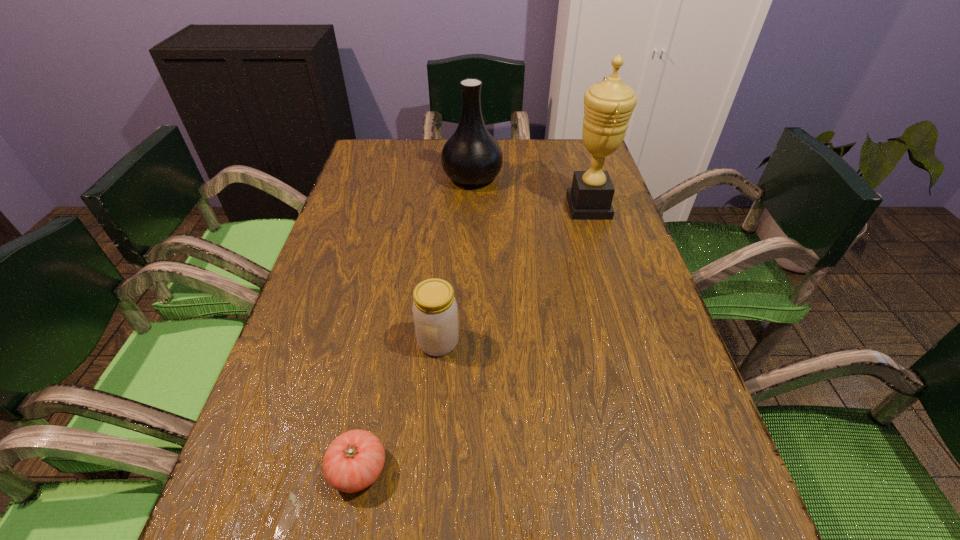
The image size is (960, 540). I want to click on the tallest object, so click(608, 105).

You are a GUI agent. You are given a task and a screenshot of the screen. Output one action in this format:
    pyautogui.click(x=<x>, y=<y>)
    Task: Click on the rightmost object
    This screenshot has height=540, width=960.
    Given the screenshot: What is the action you would take?
    pyautogui.click(x=608, y=105)

I want to click on vase, so click(472, 156).

Where is `the third tallest object`? the third tallest object is located at coordinates (435, 313).

This screenshot has width=960, height=540. I want to click on jar, so click(x=435, y=313).

Identify the location of the shortest object. (353, 461).

You are a GUI agent. You are given a task and a screenshot of the screen. Output one action in this format:
    pyautogui.click(x=<x>, y=<y>)
    Task: Click on the tomato
    This screenshot has height=540, width=960.
    Given the screenshot: What is the action you would take?
    pyautogui.click(x=353, y=461)

Find the location of a particular element. vacant space situated 0.250m at the front of the tallest object with handles is located at coordinates (476, 207).

This screenshot has height=540, width=960. I want to click on vacant space situated 0.240m at the front of the tallest object with handles, so click(x=480, y=207).

Where is `free space located at the front of the tallest object with handles`? This screenshot has width=960, height=540. free space located at the front of the tallest object with handles is located at coordinates (x=509, y=207).